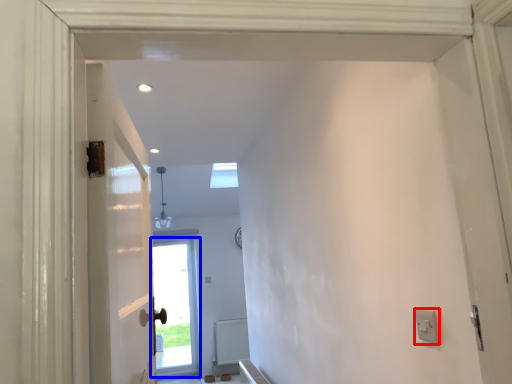
Question: Among these objects, which one is farthest to the camera, electric outlet (highlighted by a red box) or door (highlighted by a blue box)?

Choices:
 (A) electric outlet
 (B) door

Answer: (B)